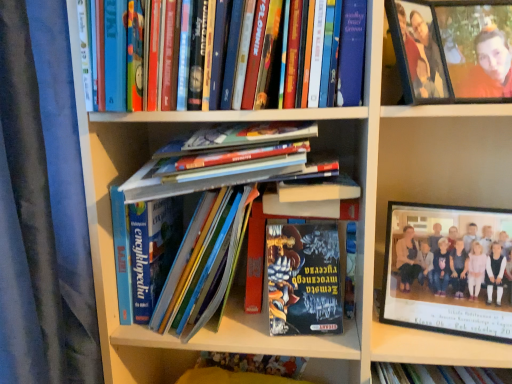
The height and width of the screenshot is (384, 512). I want to click on hardcover books at center, which is counted as the fourth book, starting from the top, so click(209, 273).

This screenshot has width=512, height=384. I want to click on hardcover book at center, the 2th book from the top, so click(186, 183).

What do you see at coordinates (304, 279) in the screenshot? Image resolution: width=512 pixels, height=384 pixels. I see `shiny metallic book at center, which is the first book in bottom-to-top order` at bounding box center [304, 279].

Where is `hardcover book at upper center, the 5th book when ordered from bottom to top`? hardcover book at upper center, the 5th book when ordered from bottom to top is located at coordinates click(x=234, y=57).

Locate an element on the screen. The width and height of the screenshot is (512, 384). wooden photo frame at upper right is located at coordinates (453, 49).

Where is `the 2nd book in front of the shiny metallic book at center, which is the first book in bottom-to-top order, counting from the anchor's position`? the 2nd book in front of the shiny metallic book at center, which is the first book in bottom-to-top order, counting from the anchor's position is located at coordinates (186, 183).

Is point (170, 187) more distant than point (283, 278)?

No.

Considering the sizes of hardcover book at center, the 2th book from the top, and shiny metallic book at center, which is the first book in bottom-to-top order, in the image, is hardcover book at center, the 2th book from the top, taller or shorter than shiny metallic book at center, which is the first book in bottom-to-top order,?

In the image, hardcover book at center, the 2th book from the top, appears to be shorter than shiny metallic book at center, which is the first book in bottom-to-top order.

Looking at this image, from the image's perspective, who appears lower, hardcover book at center, the 2th book from the top, or hardcover books at center, placed as the 2th book when sorted from bottom to top?

From the image's view, hardcover books at center, placed as the 2th book when sorted from bottom to top, is below.

Considering the positions of points (228, 175) and (229, 279), is point (228, 175) closer to camera compared to point (229, 279)?

Yes, it is.

Which object is wider, hardcover book at center, the 2th book from the top, or hardcover books at center, placed as the 2th book when sorted from bottom to top?

hardcover books at center, placed as the 2th book when sorted from bottom to top.

From the picture: Is hardcover books at center, the third book from the bottom, not close to matte plastic frame at upper right?

Actually, hardcover books at center, the third book from the bottom, and matte plastic frame at upper right are a little close together.

Is hardcover books at center, marked as the third book in a top-to-bottom arrangement, not inside matte plastic frame at upper right?

That's correct, hardcover books at center, marked as the third book in a top-to-bottom arrangement, is outside of matte plastic frame at upper right.

From a real-world perspective, relative to matte plastic frame at upper right, is hardcover books at center, marked as the third book in a top-to-bottom arrangement, vertically above or below?

Clearly, from a real-world perspective, hardcover books at center, marked as the third book in a top-to-bottom arrangement, is below matte plastic frame at upper right.

Considering their positions, is hardcover book at upper center, arranged as the 1th book when viewed from the top, located in front of or behind hardcover books at center, the third book from the bottom?

hardcover book at upper center, arranged as the 1th book when viewed from the top, is positioned closer to the viewer than hardcover books at center, the third book from the bottom.

Between hardcover book at upper center, arranged as the 1th book when viewed from the top, and hardcover books at center, marked as the third book in a top-to-bottom arrangement, which one has more height?

Standing taller between the two is hardcover books at center, marked as the third book in a top-to-bottom arrangement.

Is point (111, 76) positioned before point (126, 278)?

Yes.

What's the angular difference between hardcover book at upper center, the 5th book when ordered from bottom to top, and hardcover books at center, the third book from the bottom,'s facing directions?

The facing directions of hardcover book at upper center, the 5th book when ordered from bottom to top, and hardcover books at center, the third book from the bottom, are 0.174 degrees apart.

Considering the positions of points (373, 72) and (234, 242), is point (373, 72) closer to camera compared to point (234, 242)?

Yes, point (373, 72) is in front of point (234, 242).

Would you say black plastic frame at upper right is to the left or to the right of hardcover books at center, marked as the third book in a top-to-bottom arrangement, in the picture?

Based on their positions, black plastic frame at upper right is located to the right of hardcover books at center, marked as the third book in a top-to-bottom arrangement.

From the image's perspective, who appears lower, black plastic frame at upper right or hardcover books at center, the third book from the bottom?

From the image's view, black plastic frame at upper right is below.

Is point (202, 272) closer to viewer compared to point (433, 85)?

No.

Identify the location of person that appears in front of the hardcover books at center, placed as the 2th book when sorted from bottom to top. (421, 51).

From a real-world perspective, is hardcover books at center, which is counted as the fourth book, starting from the top, located higher than matte plastic frame at upper right?

No.

Would you consider hardcover books at center, which is counted as the fourth book, starting from the top, to be distant from matte plastic frame at upper right?

No, hardcover books at center, which is counted as the fourth book, starting from the top, is not far away from matte plastic frame at upper right.

Is point (124, 316) positioned behind point (326, 238)?

Yes.

Is hardcover books at center, marked as the third book in a top-to-bottom arrangement, positioned far away from shiny metallic book at center, which is the 5th book in top-to-bottom order?

No, there isn't a large distance between hardcover books at center, marked as the third book in a top-to-bottom arrangement, and shiny metallic book at center, which is the 5th book in top-to-bottom order.

From the image's perspective, is hardcover books at center, marked as the third book in a top-to-bottom arrangement, above or below shiny metallic book at center, which is the 5th book in top-to-bottom order?

hardcover books at center, marked as the third book in a top-to-bottom arrangement, is situated higher than shiny metallic book at center, which is the 5th book in top-to-bottom order, in the image.

How many degrees apart are the facing directions of hardcover books at center, marked as the third book in a top-to-bottom arrangement, and shiny metallic book at center, which is the 5th book in top-to-bottom order?

They differ by 14.9 degrees in their facing directions.

The image size is (512, 384). I want to click on book that is the 3rd object to the right of the hardcover book at center, which ranks as the fourth book in bottom-to-top order, starting at the anchor, so click(304, 279).

Which book is the 1st one when counting from the front of the hardcover books at center, placed as the 2th book when sorted from bottom to top? Please provide its 2D coordinates.

[(186, 183)]

Looking at the image, which one is located closer to wooden photo frame at upper right, hardcover book at upper center, the 5th book when ordered from bottom to top, or black plastic frame at upper right?

The object closer to wooden photo frame at upper right is black plastic frame at upper right.

When comparing their distances from black plastic frame at upper right, does hardcover book at center, which ranks as the fourth book in bottom-to-top order, or hardcover books at center, which is counted as the fourth book, starting from the top, seem closer?

Based on the image, hardcover book at center, which ranks as the fourth book in bottom-to-top order, appears to be nearer to black plastic frame at upper right.

Based on the photo, based on their spatial positions, is matte plastic frame at upper right or wooden photo frame at upper right closer to hardcover book at center, which ranks as the fourth book in bottom-to-top order?

wooden photo frame at upper right is positioned closer to the anchor hardcover book at center, which ranks as the fourth book in bottom-to-top order.

Based on their spatial positions, is black plastic frame at upper right or shiny metallic book at center, which is the 5th book in top-to-bottom order, further from wooden photo frame at upper right?

shiny metallic book at center, which is the 5th book in top-to-bottom order, is further to wooden photo frame at upper right.

Considering their positions, is hardcover books at center, which is counted as the fourth book, starting from the top, positioned further to matte plastic frame at upper right than hardcover book at center, the 2th book from the top?

hardcover books at center, which is counted as the fourth book, starting from the top, lies further to matte plastic frame at upper right than the other object.

Looking at the image, which one is located closer to shiny metallic book at center, which is the 5th book in top-to-bottom order, hardcover book at upper center, arranged as the 1th book when viewed from the top, or hardcover books at center, which is counted as the fourth book, starting from the top?

Based on the image, hardcover books at center, which is counted as the fourth book, starting from the top, appears to be nearer to shiny metallic book at center, which is the 5th book in top-to-bottom order.

Looking at the image, which one is located closer to wooden photo frame at upper right, matte plastic frame at upper right or hardcover books at center, the third book from the bottom?

matte plastic frame at upper right is closer to wooden photo frame at upper right.

Estimate the real-world distances between objects in this image. Which object is further from shiny metallic book at center, which is the 5th book in top-to-bottom order, black plastic frame at upper right or hardcover books at center, placed as the 2th book when sorted from bottom to top?

black plastic frame at upper right is further to shiny metallic book at center, which is the 5th book in top-to-bottom order.

In order to click on shelf between hardcover book at upper center, the 5th book when ordered from bottom to top, and shiny metallic book at center, which is the 5th book in top-to-bottom order, in the up-down direction in this screenshot , I will do `click(434, 150)`.

You are a GUI agent. You are given a task and a screenshot of the screen. Output one action in this format:
    pyautogui.click(x=<x>, y=<y>)
    Task: Click on the shelf located between hardcover book at upper center, arranged as the 1th book when viewed from the top, and wooden photo frame at upper right in the left-right direction
    The width and height of the screenshot is (512, 384).
    Given the screenshot: What is the action you would take?
    pyautogui.click(x=434, y=150)

You are a GUI agent. You are given a task and a screenshot of the screen. Output one action in this format:
    pyautogui.click(x=<x>, y=<y>)
    Task: Click on the shelf between wooden photo frame at upper right and shiny metallic book at center, which is the first book in bottom-to-top order, vertically
    
    Given the screenshot: What is the action you would take?
    pyautogui.click(x=434, y=150)

Image resolution: width=512 pixels, height=384 pixels. Identify the location of person between wooden photo frame at upper right and black plastic frame at upper right in the up-down direction. (421, 51).